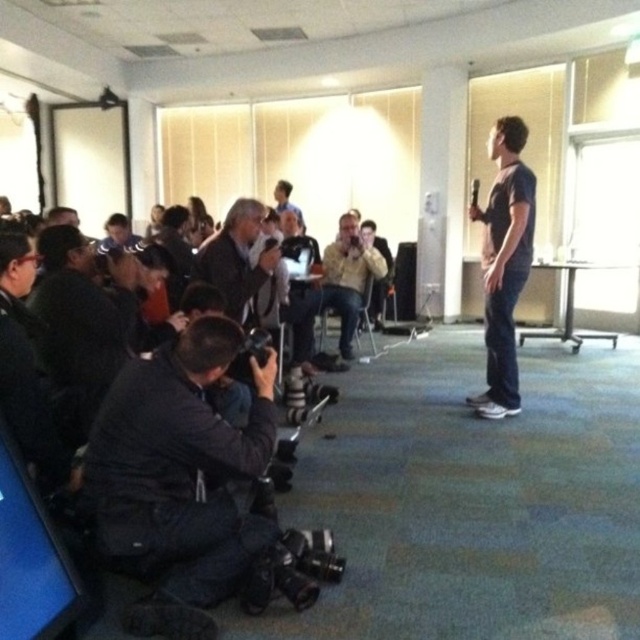
Question: Among these points, which one is nearest to the camera?

Choices:
 (A) (308, 604)
 (B) (253, 356)
 (C) (220, 515)

Answer: (A)

Question: Among these objects, which one is nearest to the camera?

Choices:
 (A) black plastic camera at lower center
 (B) dark blue t-shirt at center

Answer: (A)

Question: Which is nearer to the dark blue t-shirt at center?

Choices:
 (A) black rubber video camera at lower center
 (B) black fabric camera at lower left
 (C) gray fabric jacket at center
 (D) light brown leather jacket at center

Answer: (C)

Question: Is black rubber video camera at lower center above gray fabric jacket at center?

Choices:
 (A) yes
 (B) no

Answer: (B)

Question: Does dark blue t-shirt at center have a greater width compared to black rubber video camera at lower center?

Choices:
 (A) no
 (B) yes

Answer: (A)

Question: Considering the relative positions of black rubber video camera at lower center and black plastic camera at lower center in the image provided, where is black rubber video camera at lower center located with respect to black plastic camera at lower center?

Choices:
 (A) below
 (B) above

Answer: (A)